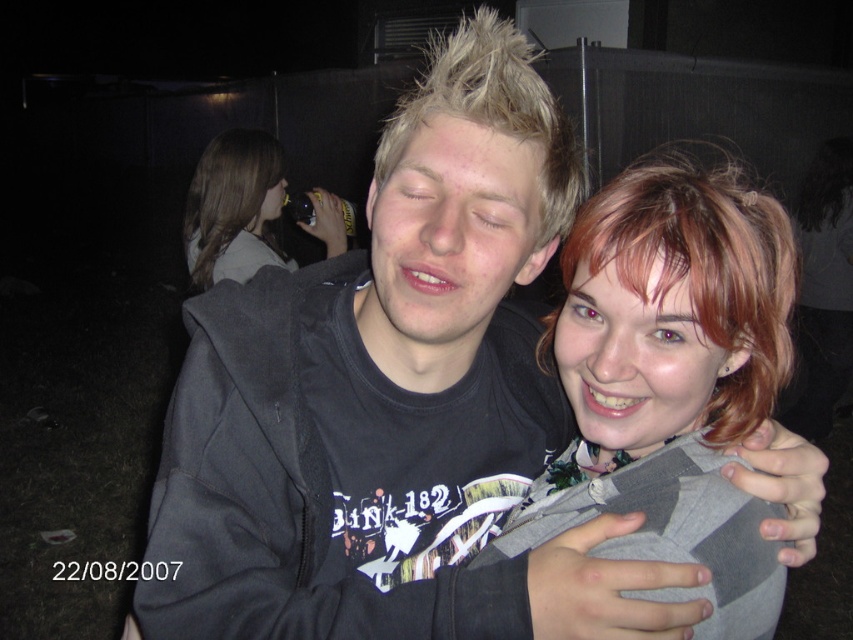
Who is shorter, matte gray hoodie at center or brown hair at upper left?

matte gray hoodie at center is shorter.

Does matte gray hoodie at center have a greater width compared to brown hair at upper left?

Incorrect, matte gray hoodie at center's width does not surpass brown hair at upper left's.

Measure the distance between matte gray hoodie at center and camera.

They are 25.10 inches apart.

Identify the location of matte gray hoodie at center. (668, 372).